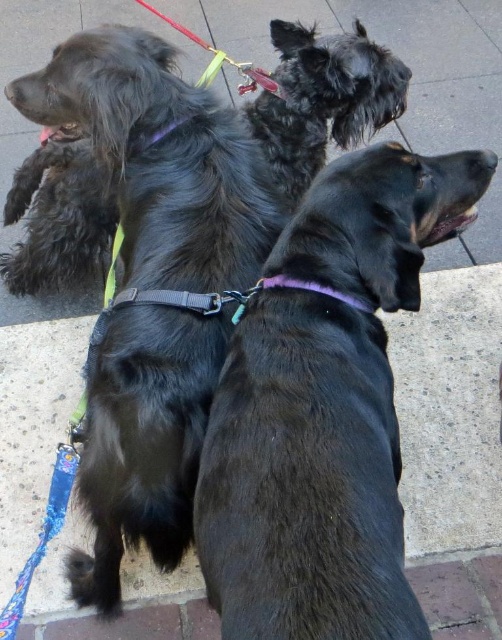
You are a photographer trying to capture a clear shot of both the black matte dog at center and the purple fabric neckband at center. Based on their positions, which one is more likely to be fully visible in the photo?

The black matte dog at center is much taller than the purple fabric neckband at center, so the dog may block part of the neckband from view, making the neckband less likely to be fully visible.

You are a photographer trying to capture a photo of the shiny black fur at upper left and the purple fabric neckband at center. Which dog should you focus on first if you want to capture them both in the same frame without moving the camera?

You should focus on the shiny black fur at upper left first because it is positioned to the left of the purple fabric neckband at center, so capturing them both in the same frame would require starting with the one on the left.